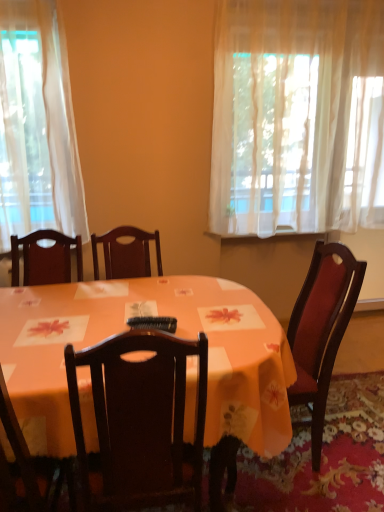
Find the location of `unoccupied region to the right of black plastic remote control at center`. unoccupied region to the right of black plastic remote control at center is located at coordinates (202, 329).